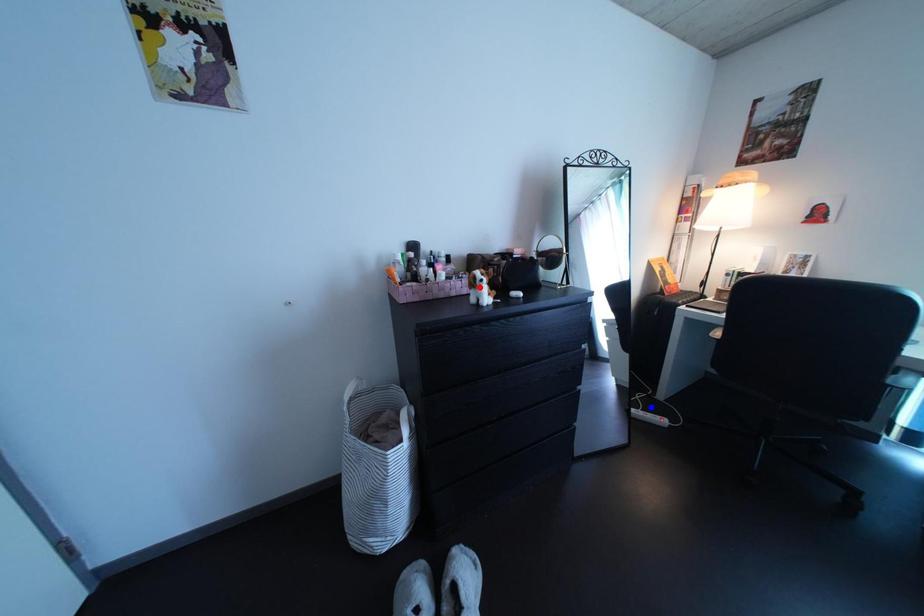
Question: Which of the two points in the image is closer to the camera?

Choices:
 (A) Blue point is closer.
 (B) Red point is closer.

Answer: (B)